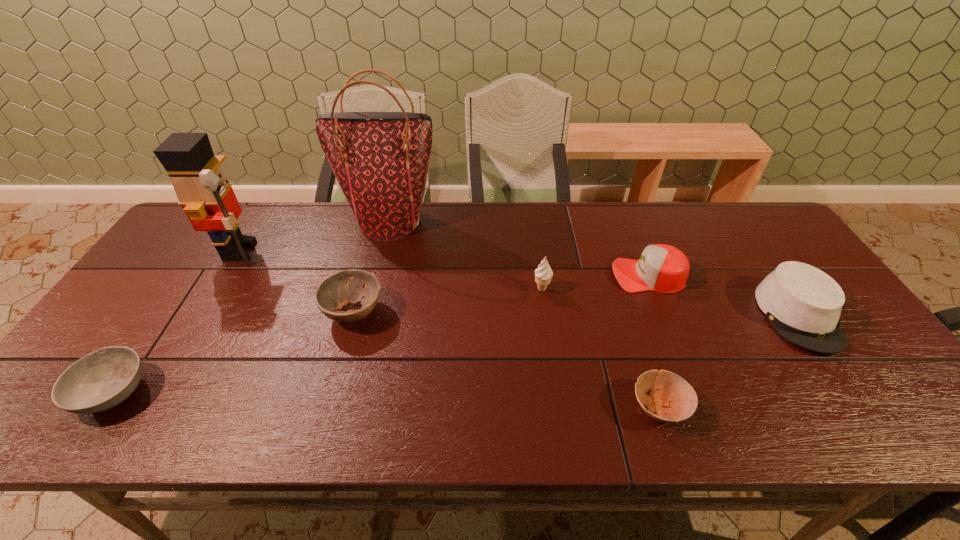
What are the coordinates of `vacant space situated 0.310m on the front of the handbag` in the screenshot? It's located at [368, 317].

Where is `vacant space located in front of the nutcracker holding the staff`? This screenshot has height=540, width=960. vacant space located in front of the nutcracker holding the staff is located at coordinates (283, 251).

Where is `free space located 0.340m on the front-facing side of the icecream`? This screenshot has height=540, width=960. free space located 0.340m on the front-facing side of the icecream is located at coordinates (559, 408).

You are a GUI agent. You are given a task and a screenshot of the screen. Output one action in this format:
    pyautogui.click(x=<x>, y=<y>)
    Task: Click on the vacant space located 0.100m on the front-facing side of the rightmost object
    The width and height of the screenshot is (960, 540).
    Given the screenshot: What is the action you would take?
    pyautogui.click(x=852, y=395)

Identify the location of free space located 0.400m on the front-facing side of the baseball cap. [472, 275].

Find the location of `free point located on the front-facing side of the baseball cap`. free point located on the front-facing side of the baseball cap is located at coordinates (553, 275).

You are a GUI agent. You are given a task and a screenshot of the screen. Output one action in this format:
    pyautogui.click(x=<x>, y=<y>)
    Task: Click on the free space located 0.340m on the front-facing side of the baseball cap
    Image resolution: width=960 pixels, height=540 pixels.
    Given the screenshot: What is the action you would take?
    click(x=493, y=275)

This screenshot has width=960, height=540. In order to click on free region located on the left of the second bowl from right to left in this screenshot , I will do `click(254, 312)`.

The height and width of the screenshot is (540, 960). I want to click on free location located 0.180m on the right of the leftmost bowl, so pos(228,392).

You are a GUI agent. You are given a task and a screenshot of the screen. Output one action in this format:
    pyautogui.click(x=<x>, y=<y>)
    Task: Click on the free region located 0.290m on the right of the rightmost bowl
    
    Given the screenshot: What is the action you would take?
    pyautogui.click(x=821, y=408)